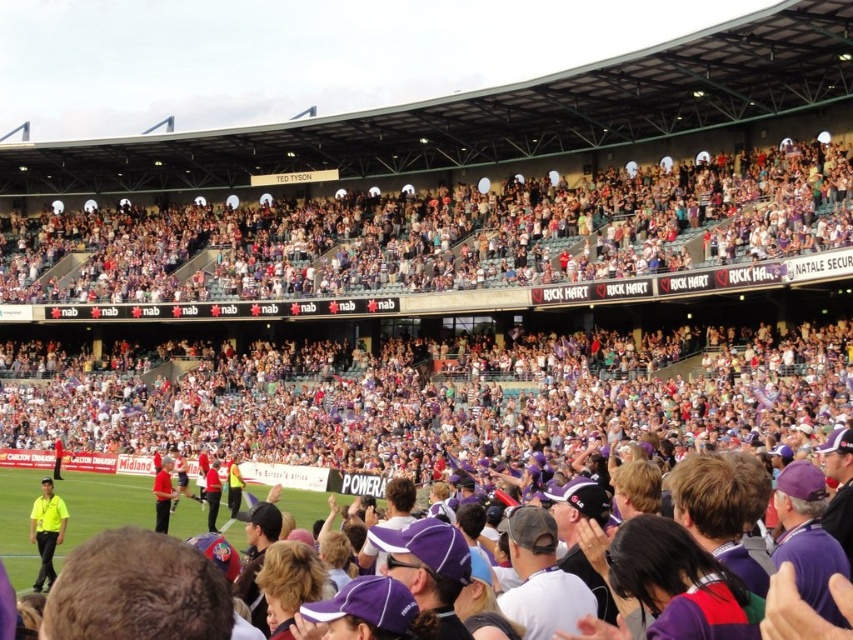
Does yellow shirt at lower left appear over matte red shirt at center?

No.

Is point (39, 573) positioned in front of point (161, 504)?

Yes, it is in front of point (161, 504).

I want to click on yellow shirt at lower left, so click(45, 531).

Where is `yellow shirt at lower left`? Image resolution: width=853 pixels, height=640 pixels. yellow shirt at lower left is located at coordinates point(45,531).